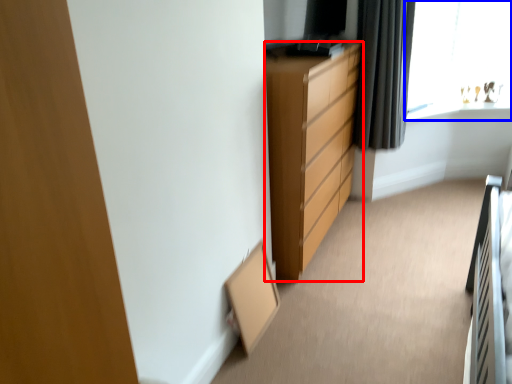
Question: Which of the following is the closest to the observer, chest of drawers (highlighted by a red box) or window (highlighted by a blue box)?

Choices:
 (A) chest of drawers
 (B) window

Answer: (A)